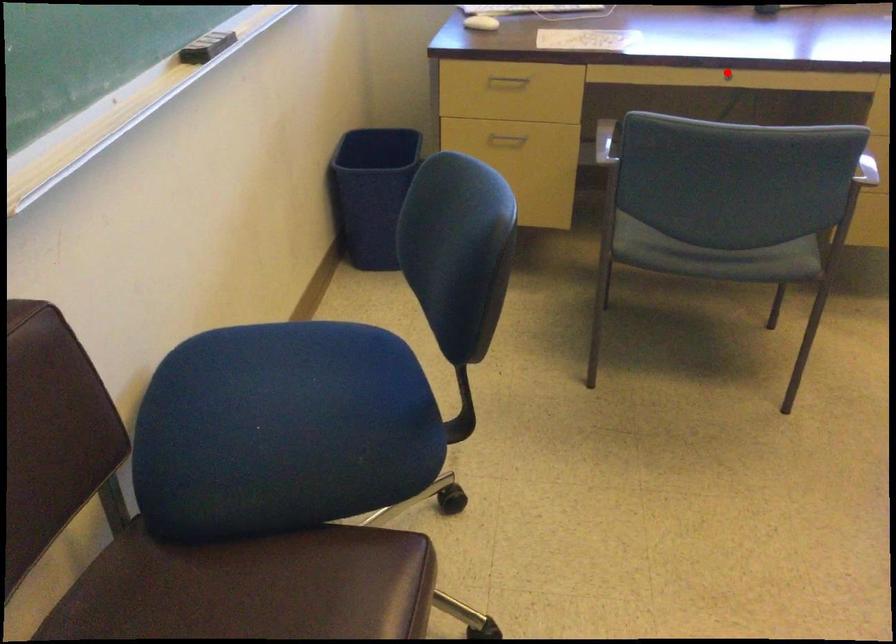
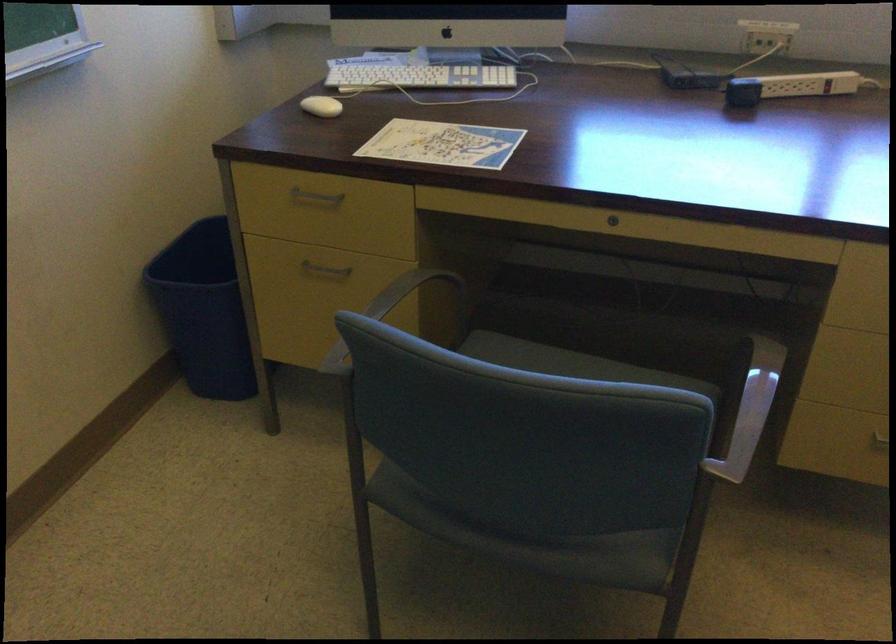
Find the pixel in the second image that matches the highlighted location in the first image.

(613, 220)